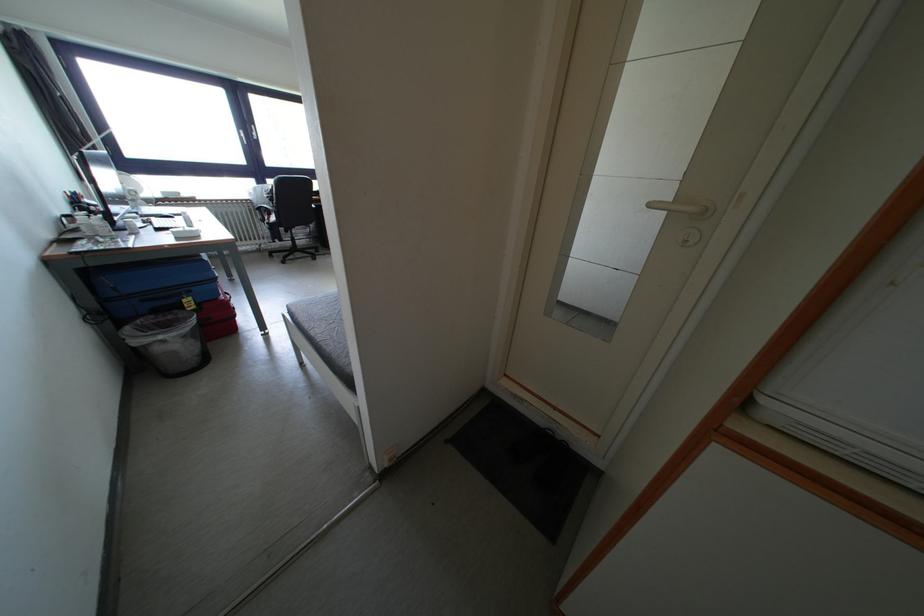
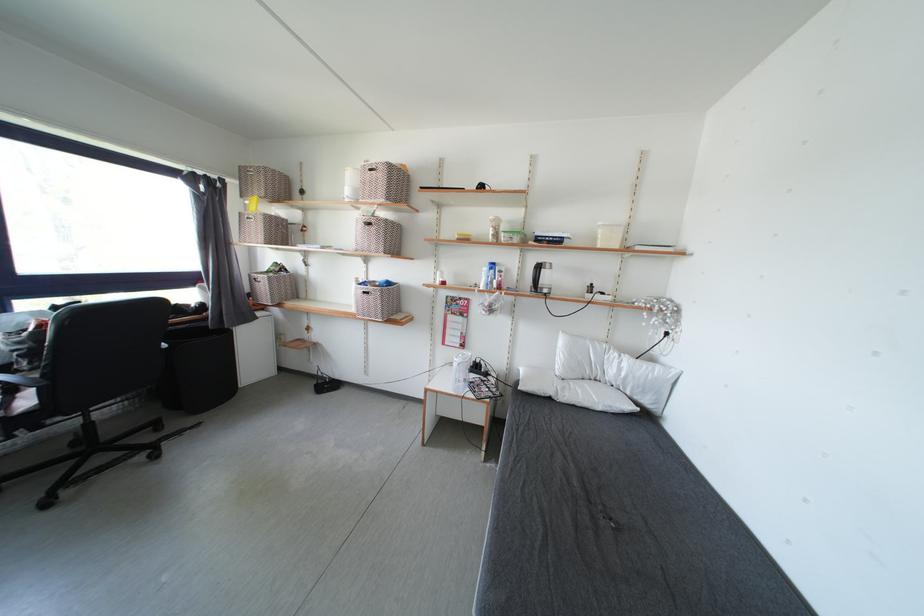
Locate, in the second image, the point that corresponds to point 280,223 in the first image.

(33, 407)